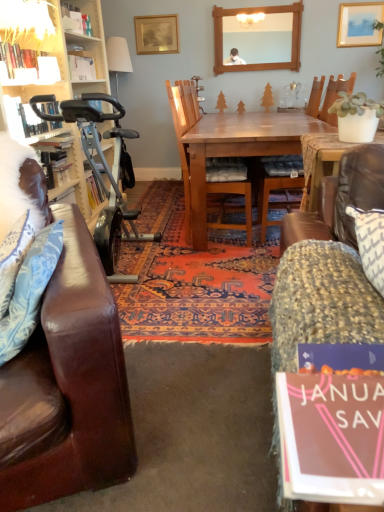
Question: Is blue floral fabric pillow at left not close to white feathered pillow at left?

Choices:
 (A) yes
 (B) no

Answer: (A)

Question: Does blue floral fabric pillow at left have a larger size compared to white feathered pillow at left?

Choices:
 (A) yes
 (B) no

Answer: (B)

Question: Can you confirm if blue floral fabric pillow at left is thinner than white feathered pillow at left?

Choices:
 (A) no
 (B) yes

Answer: (B)

Question: Considering the relative sizes of blue floral fabric pillow at left and white feathered pillow at left in the image provided, is blue floral fabric pillow at left wider than white feathered pillow at left?

Choices:
 (A) no
 (B) yes

Answer: (A)

Question: From a real-world perspective, is blue floral fabric pillow at left positioned over white feathered pillow at left based on gravity?

Choices:
 (A) no
 (B) yes

Answer: (A)

Question: From a real-world perspective, is blue floral fabric pillow at left above or below silver metallic exercise bike at left?

Choices:
 (A) above
 (B) below

Answer: (A)

Question: Do you think blue floral fabric pillow at left is within silver metallic exercise bike at left, or outside of it?

Choices:
 (A) outside
 (B) inside

Answer: (A)

Question: Is blue floral fabric pillow at left in front of or behind silver metallic exercise bike at left in the image?

Choices:
 (A) front
 (B) behind

Answer: (A)

Question: Considering the positions of blue floral fabric pillow at left and silver metallic exercise bike at left in the image, is blue floral fabric pillow at left taller or shorter than silver metallic exercise bike at left?

Choices:
 (A) tall
 (B) short

Answer: (B)

Question: Considering their positions, is white feathered pillow at left located in front of or behind matte gold picture frame at upper right, which is the 1th picture frame in front-to-back order?

Choices:
 (A) front
 (B) behind

Answer: (A)

Question: Is white feathered pillow at left to the left or to the right of matte gold picture frame at upper right, arranged as the second picture frame when viewed from the back, in the image?

Choices:
 (A) left
 (B) right

Answer: (A)

Question: Looking at their shapes, would you say white feathered pillow at left is wider or thinner than matte gold picture frame at upper right, which is the 1th picture frame in front-to-back order?

Choices:
 (A) wide
 (B) thin

Answer: (A)

Question: Considering the positions of white feathered pillow at left and matte gold picture frame at upper right, arranged as the second picture frame when viewed from the back, in the image, is white feathered pillow at left taller or shorter than matte gold picture frame at upper right, arranged as the second picture frame when viewed from the back,?

Choices:
 (A) tall
 (B) short

Answer: (A)

Question: Would you say matte white lampshade at upper left is to the left or to the right of white feathered pillow at left in the picture?

Choices:
 (A) left
 (B) right

Answer: (A)

Question: Do you think matte white lampshade at upper left is within white feathered pillow at left, or outside of it?

Choices:
 (A) inside
 (B) outside

Answer: (B)